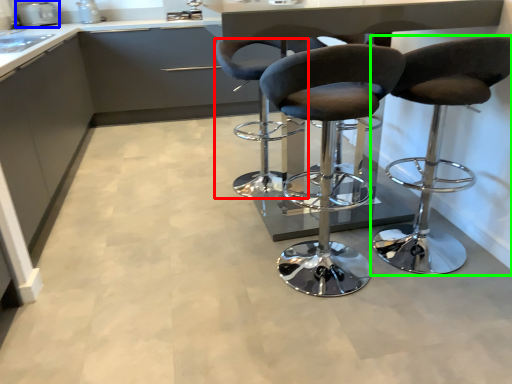
Question: Estimate the real-world distances between objects in this image. Which object is farther from chair (highlighted by a red box), appliance (highlighted by a blue box) or chair (highlighted by a green box)?

Choices:
 (A) appliance
 (B) chair

Answer: (A)